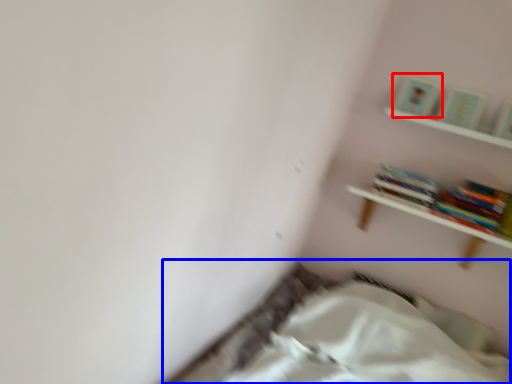
Question: Which object is closer to the camera taking this photo, paperback book (highlighted by a red box) or bed (highlighted by a blue box)?

Choices:
 (A) paperback book
 (B) bed

Answer: (B)